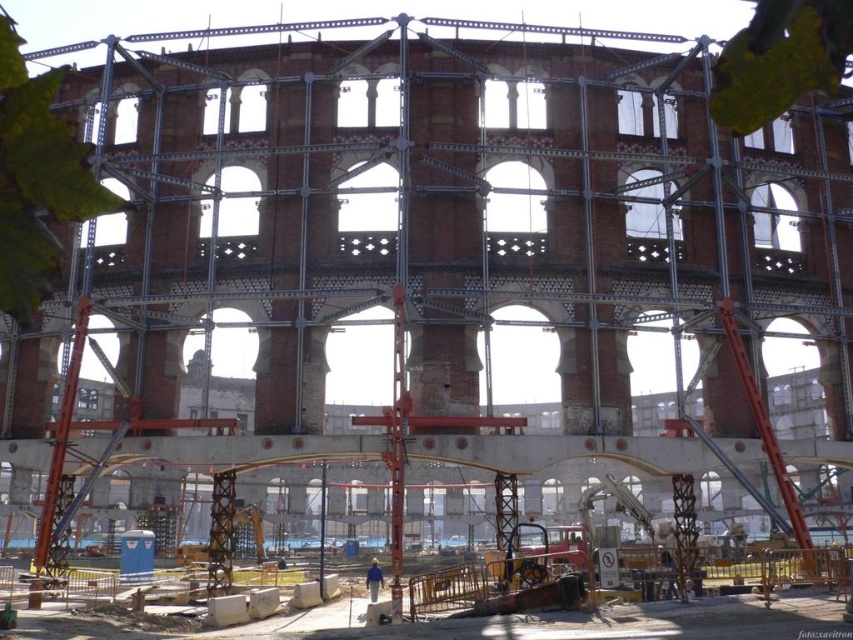
Does rustic wood construction site at lower center have a lesser width compared to blue fabric construction worker at center?

Incorrect, rustic wood construction site at lower center's width is not less than blue fabric construction worker at center's.

Consider the image. Is rustic wood construction site at lower center positioned before blue fabric construction worker at center?

Yes.

Locate an element on the screen. The image size is (853, 640). rustic wood construction site at lower center is located at coordinates coord(491,624).